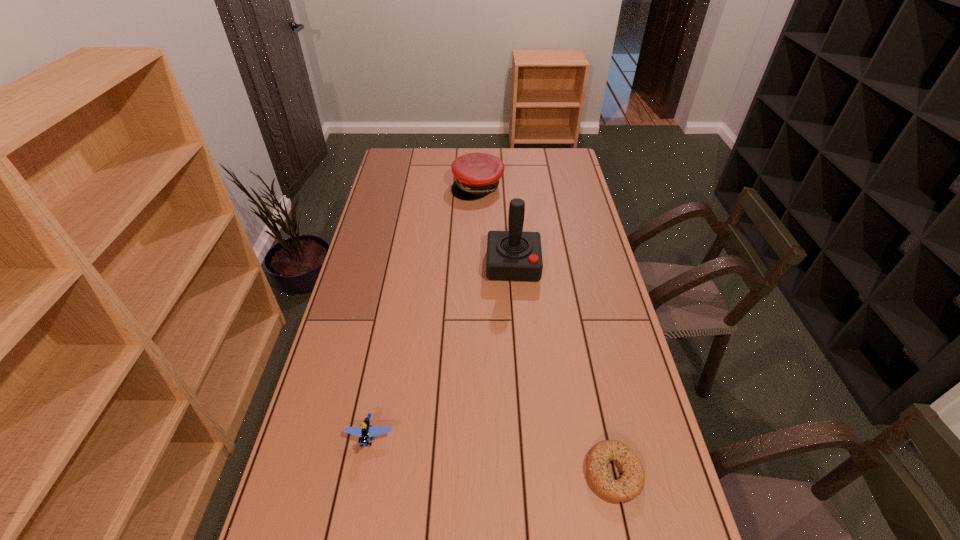
This screenshot has height=540, width=960. I want to click on object at the near right corner, so click(x=631, y=483).

In the image, there is a desktop. Where is `vacant space at the far edge`? The image size is (960, 540). vacant space at the far edge is located at coordinates (422, 168).

Find the location of `vacant point at the near edge`. vacant point at the near edge is located at coordinates (461, 526).

The height and width of the screenshot is (540, 960). What are the coordinates of `blank area at the left edge` in the screenshot? It's located at (329, 420).

You are a GUI agent. You are given a task and a screenshot of the screen. Output one action in this format:
    pyautogui.click(x=<x>, y=<y>)
    Task: Click on the free location at the right edge
    This screenshot has width=960, height=540.
    Given the screenshot: What is the action you would take?
    pyautogui.click(x=591, y=299)

I want to click on free space at the far left corner of the desktop, so click(x=411, y=156).

In the image, there is a desktop. Where is `vacant region at the near right corner`? vacant region at the near right corner is located at coordinates (642, 510).

I want to click on vacant point located between the second farthest object and the third tallest object, so click(x=442, y=351).

I want to click on free space between the second shortest object and the second tallest object, so click(x=424, y=312).

Identify the location of empty location between the leftmost object and the shortest object. (492, 455).